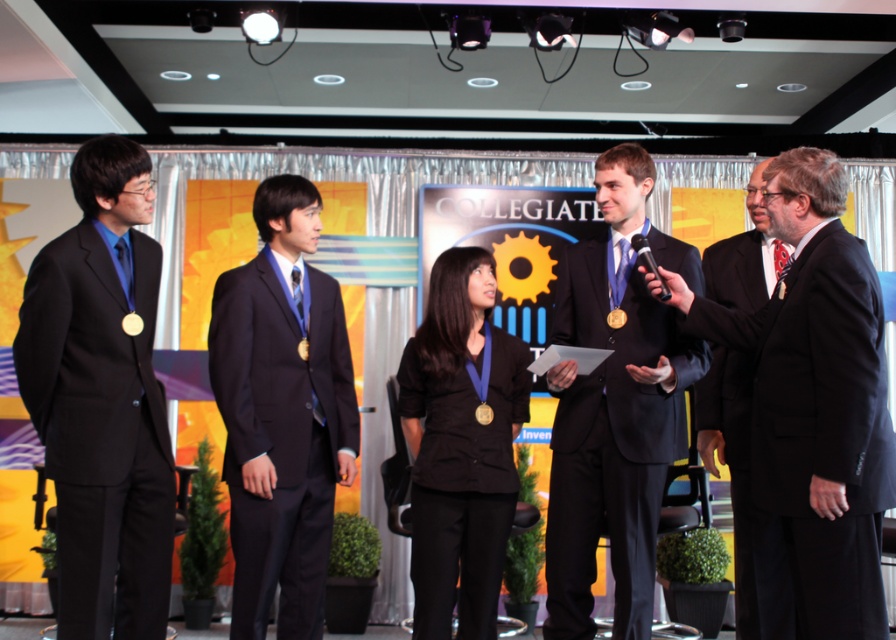
Question: Considering the real-world distances, which object is closest to the matte black suit at left?

Choices:
 (A) black wool suit at right
 (B) matte black suit at center
 (C) black matte suit at center

Answer: (B)

Question: From the image, what is the correct spatial relationship of black wool suit at right in relation to black matte suit at center?

Choices:
 (A) left
 (B) right

Answer: (B)

Question: Which object appears closest to the camera in this image?

Choices:
 (A) matte black suit at center
 (B) black matte suit at center
 (C) black satin suit at right
 (D) black wool suit at right

Answer: (D)

Question: Among these objects, which one is nearest to the camera?

Choices:
 (A) matte black suit at center
 (B) black wool suit at right

Answer: (B)

Question: In this image, where is black wool suit at right located relative to black matte suit at center?

Choices:
 (A) left
 (B) right

Answer: (B)

Question: Is matte black suit at left below black matte blazer at center?

Choices:
 (A) no
 (B) yes

Answer: (A)